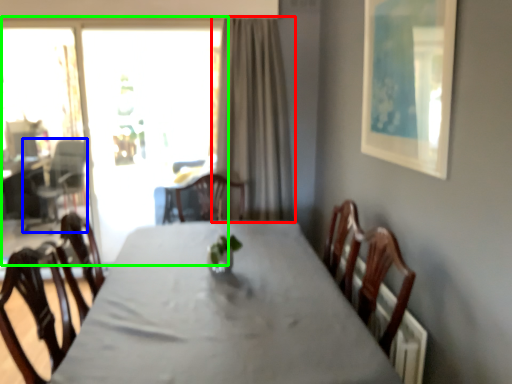
Question: Considering the real-world distances, which object is farthest from curtain (highlighted by a red box)? armchair (highlighted by a blue box) or window (highlighted by a green box)?

Choices:
 (A) armchair
 (B) window

Answer: (A)